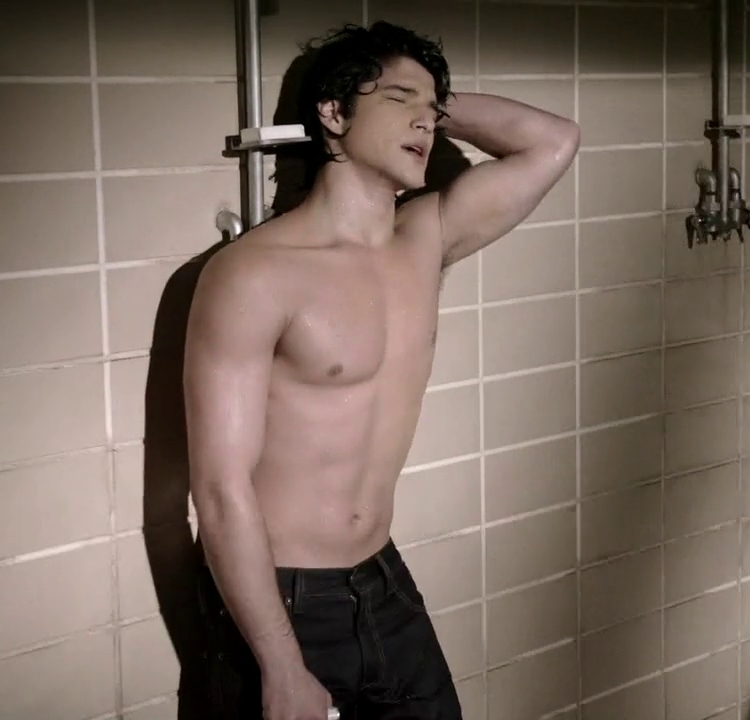
You are a GUI agent. You are given a task and a screenshot of the screen. Output one action in this format:
    pyautogui.click(x=<x>, y=<y>)
    Task: Click on the shower pipe
    This screenshot has width=750, height=720.
    Given the screenshot: What is the action you would take?
    [x=256, y=191], [x=720, y=153]